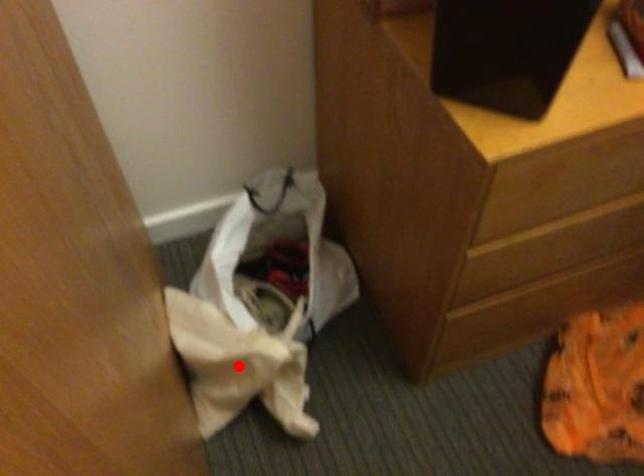
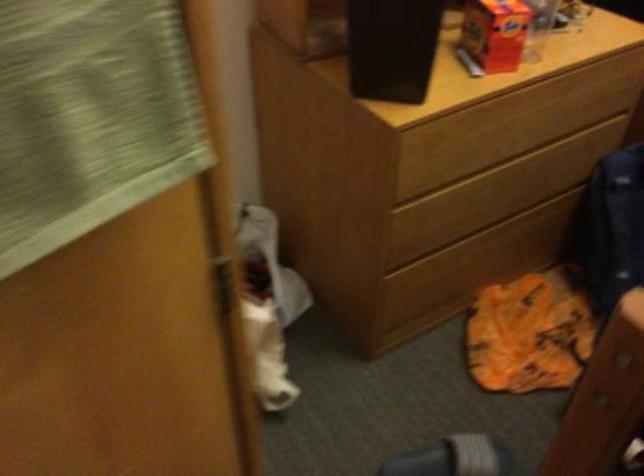
Question: I am providing you with two images of the same scene from different viewpoints. A red point is marked on the first image. At the location where the point appears in image 1, is it still visible in image 2?

Choices:
 (A) Yes
 (B) No

Answer: (B)